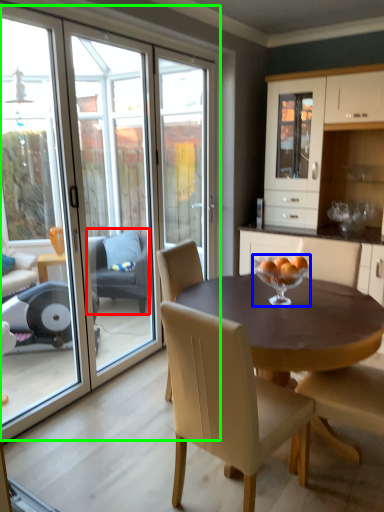
Question: Which object is the farthest from chair (highlighted by a red box)? Choose among these: glass bowl (highlighted by a blue box) or glass door (highlighted by a green box).

Choices:
 (A) glass bowl
 (B) glass door

Answer: (A)